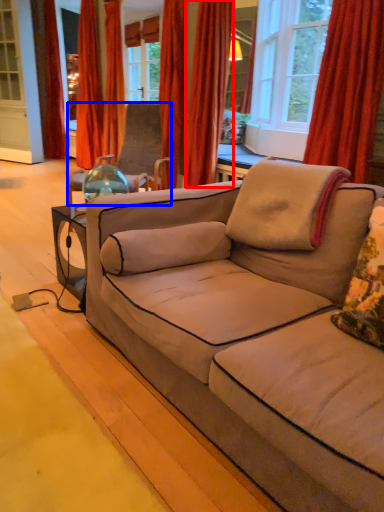
Question: Which point is further to the camera, curtain (highlighted by a red box) or chair (highlighted by a blue box)?

Choices:
 (A) curtain
 (B) chair

Answer: (A)